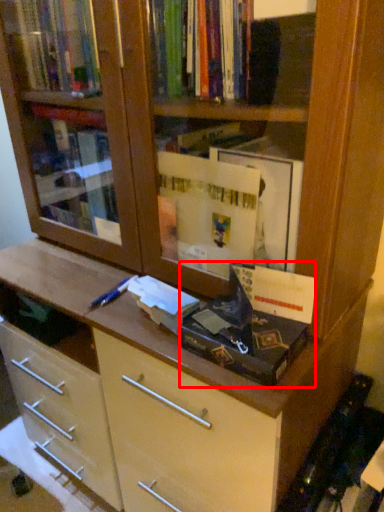
Question: From the image's perspective, what is the correct spatial positioning of paperback book (annotated by the red box) in reference to paperback book?

Choices:
 (A) above
 (B) below

Answer: (A)